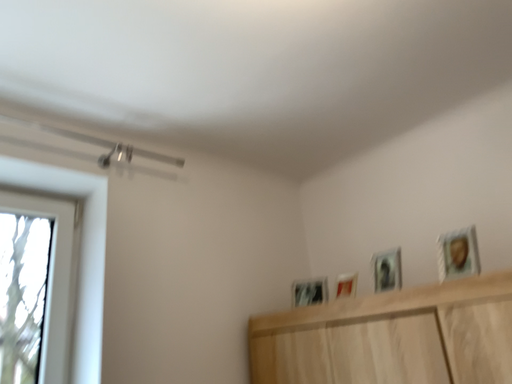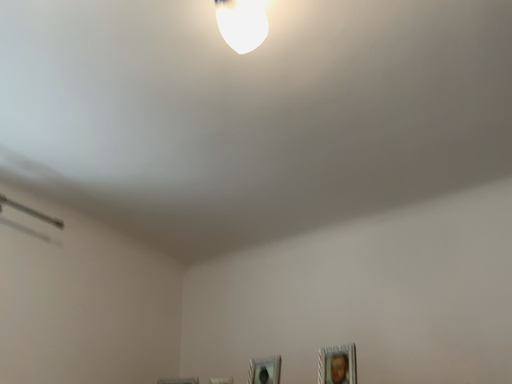
Question: Which way did the camera rotate in the video?

Choices:
 (A) rotated left
 (B) rotated right

Answer: (B)